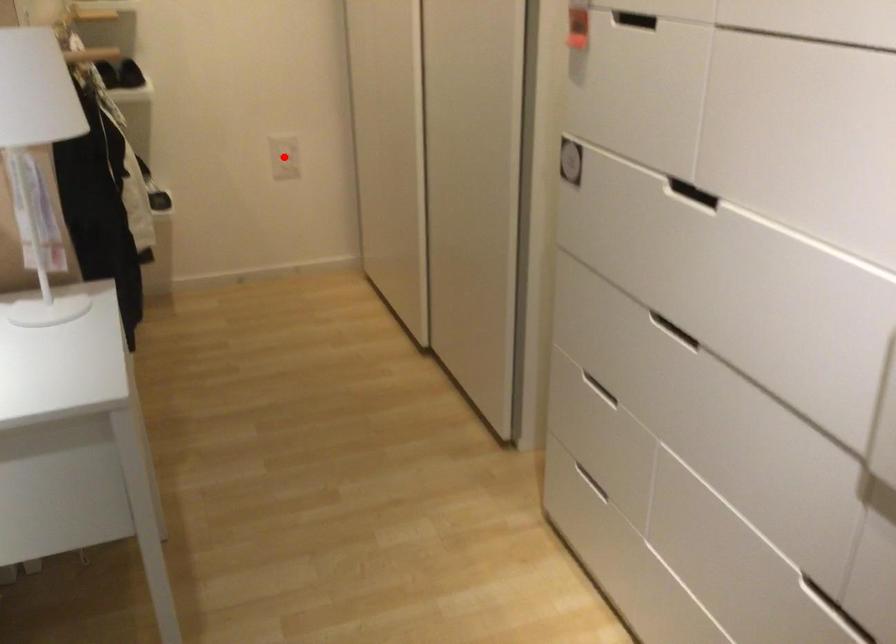
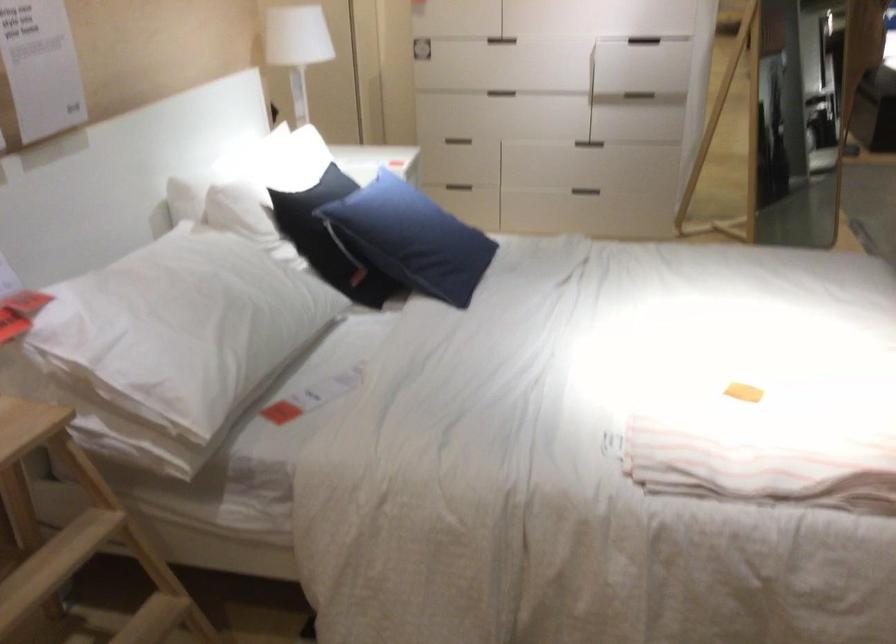
Question: I am providing you with two images of the same scene from different viewpoints. A red point is marked on the first image. Is the red point's position out of view in image 2?

Choices:
 (A) Yes
 (B) No

Answer: (A)